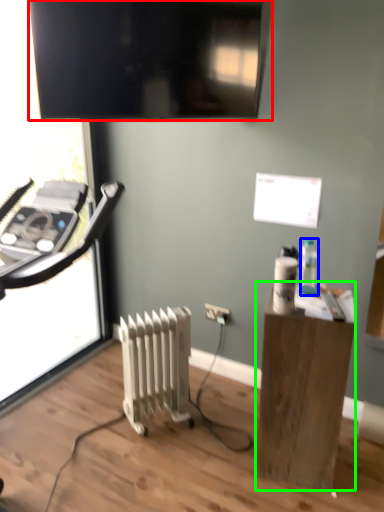
Question: Based on their relative distances, which object is nearer to television (highlighted by a red box)? Choose from bottle (highlighted by a blue box) and desk (highlighted by a green box).

Choices:
 (A) bottle
 (B) desk

Answer: (A)